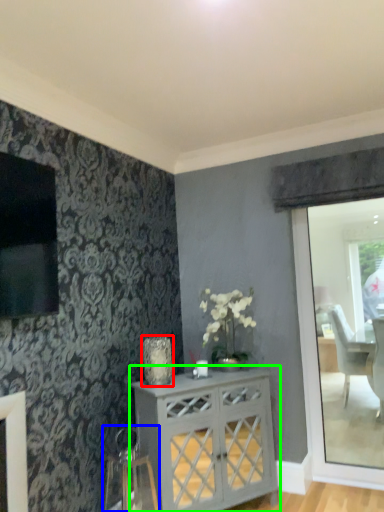
Question: Considering the real-world distances, which object is closest to vase (highlighted by a red box)? swivel chair (highlighted by a blue box) or desk (highlighted by a green box).

Choices:
 (A) swivel chair
 (B) desk

Answer: (B)